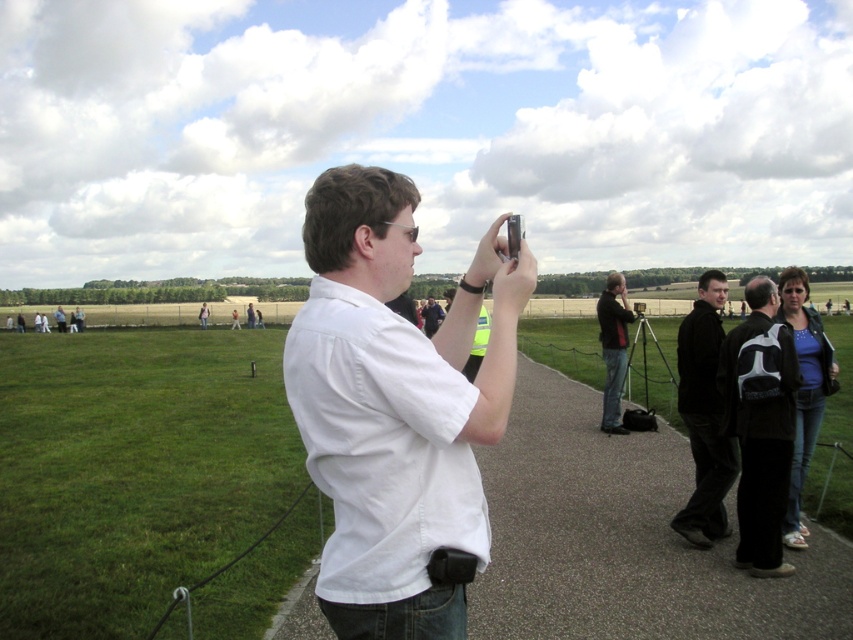
Which is in front, point (453, 492) or point (689, 337)?

Point (453, 492)

Is point (480, 285) farther from viewer compared to point (692, 362)?

No.

The image size is (853, 640). Find the location of `white matte shirt at center`. white matte shirt at center is located at coordinates (395, 406).

At what (x,y) coordinates should I click in order to perform the action: click on white matte shirt at center. Please return your answer as a coordinate pair (x, y). This screenshot has height=640, width=853. Looking at the image, I should click on (395, 406).

Does white matte shirt at center appear under black backpack at center right?

No.

You are a GUI agent. You are given a task and a screenshot of the screen. Output one action in this format:
    pyautogui.click(x=<x>, y=<y>)
    Task: Click on the white matte shirt at center
    This screenshot has width=853, height=640.
    Given the screenshot: What is the action you would take?
    pyautogui.click(x=395, y=406)

Does point (666, 600) come in front of point (717, 488)?

That is True.

Measure the distance between white shirt at center and camera.

4.40 meters

Does point (560, 609) lie behind point (722, 273)?

No, (560, 609) is closer to viewer.

Locate an element on the screen. The width and height of the screenshot is (853, 640). white shirt at center is located at coordinates (624, 538).